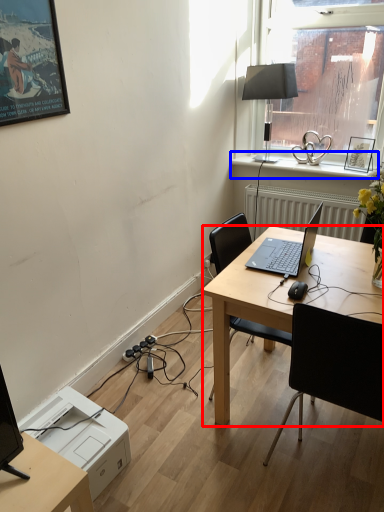
Question: Among these objects, which one is farthest to the camera, desk (highlighted by a red box) or window sill (highlighted by a blue box)?

Choices:
 (A) desk
 (B) window sill

Answer: (B)